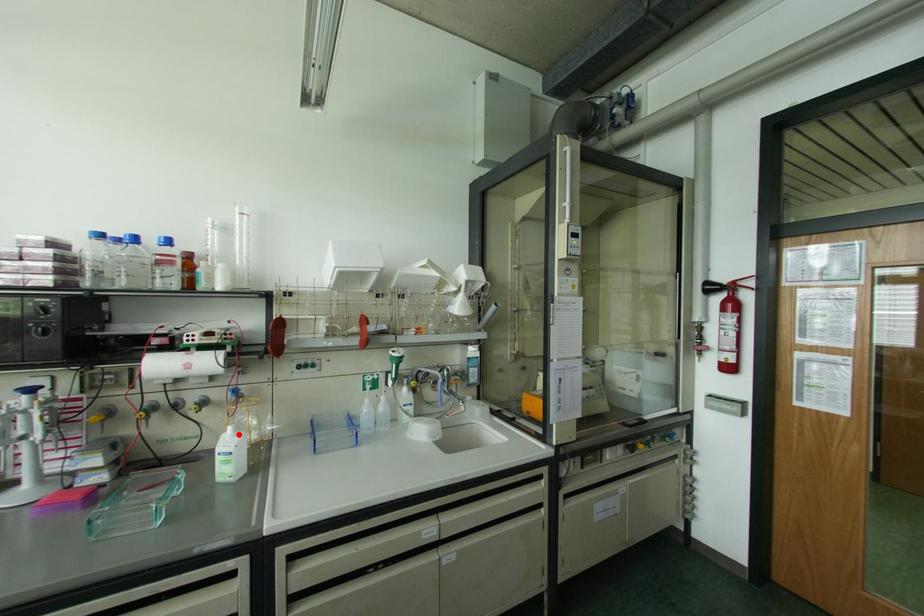
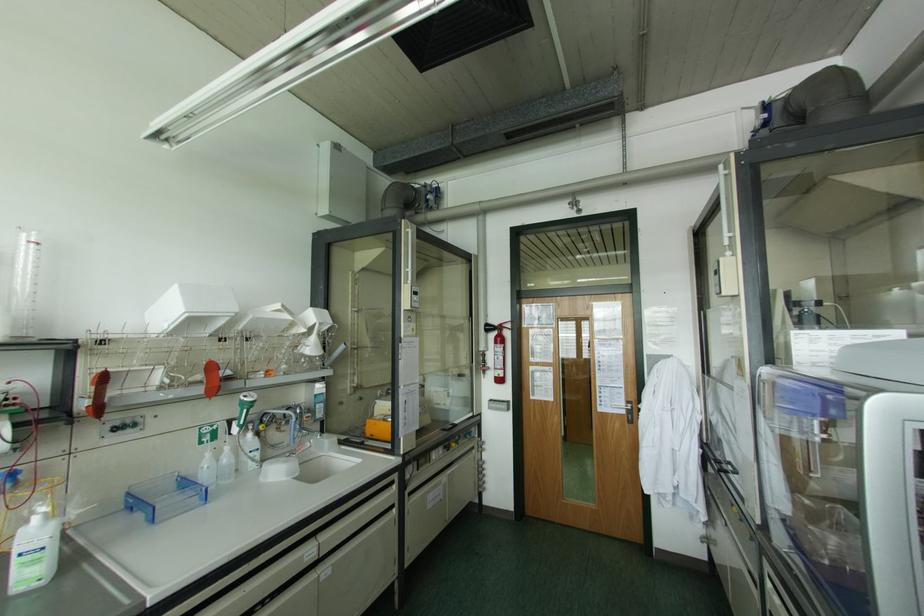
Locate, in the second image, the point that corresponds to the highlighted location in the first image.

(53, 523)